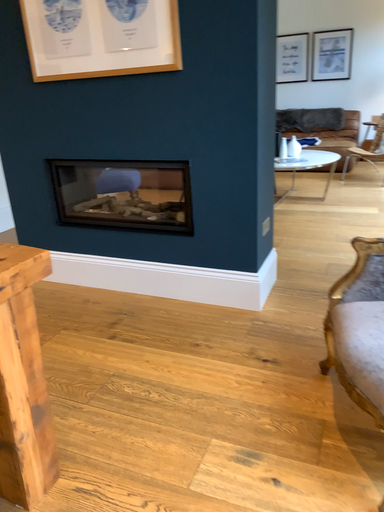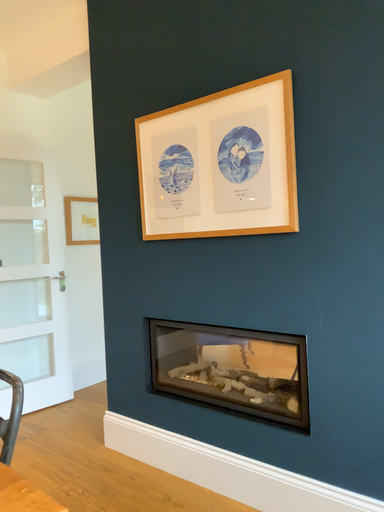
Question: How did the camera likely rotate when shooting the video?

Choices:
 (A) rotated left
 (B) rotated right

Answer: (A)